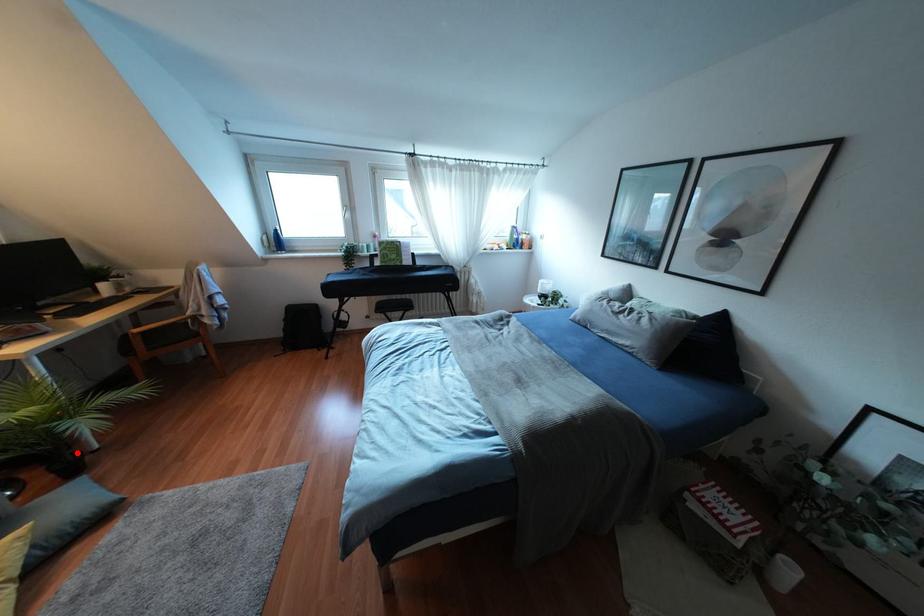
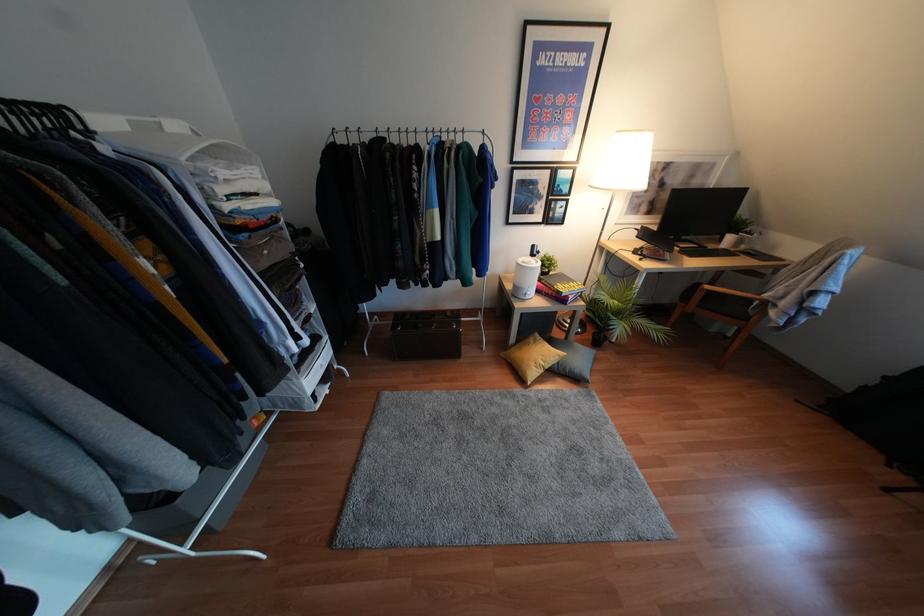
Question: A red point is marked in image1. In image2, is the corresponding 3D point closer to the camera or farther? Reply with the corresponding letter.

Choices:
 (A) The corresponding 3D point is closer.
 (B) The corresponding 3D point is farther.

Answer: (A)